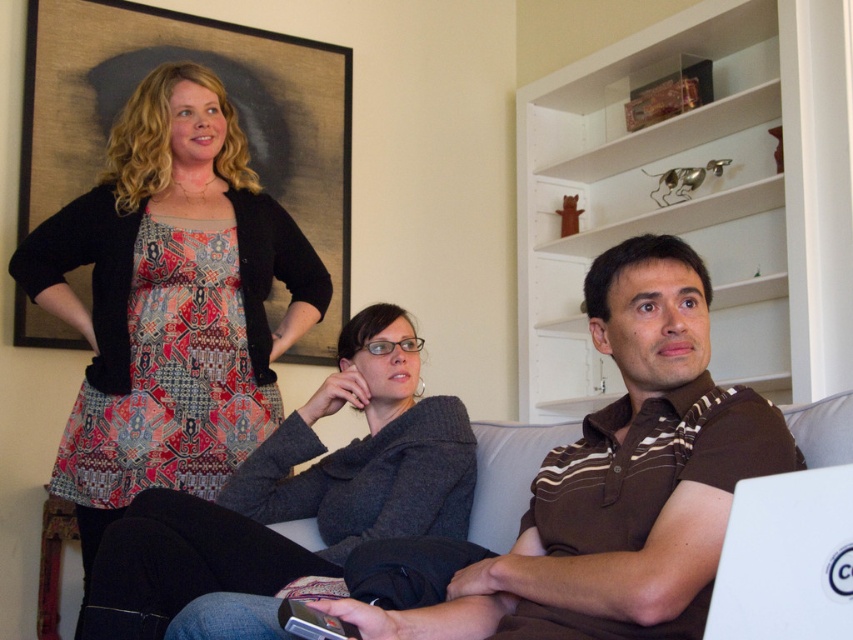
Does wooden framed artwork at upper left have a greater width compared to white plastic laptop at lower right?

Yes, wooden framed artwork at upper left is wider than white plastic laptop at lower right.

Where is `wooden framed artwork at upper left`? wooden framed artwork at upper left is located at coordinates (227, 97).

The image size is (853, 640). Identify the location of wooden framed artwork at upper left. (227, 97).

Is point (234, 241) in front of point (828, 560)?

No, (234, 241) is further to viewer.

This screenshot has width=853, height=640. In order to click on patterned fabric dress at upper left in this screenshot , I will do `click(170, 301)`.

What do you see at coordinates (170, 301) in the screenshot?
I see `patterned fabric dress at upper left` at bounding box center [170, 301].

Find the location of a particular element. patterned fabric dress at upper left is located at coordinates (170, 301).